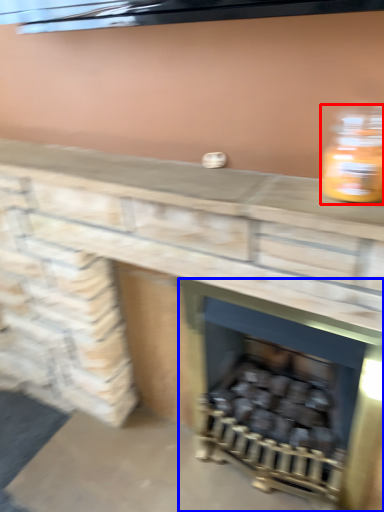
Question: Which point is closer to the camera, bottle (highlighted by a red box) or wood burning stove (highlighted by a blue box)?

Choices:
 (A) bottle
 (B) wood burning stove

Answer: (A)